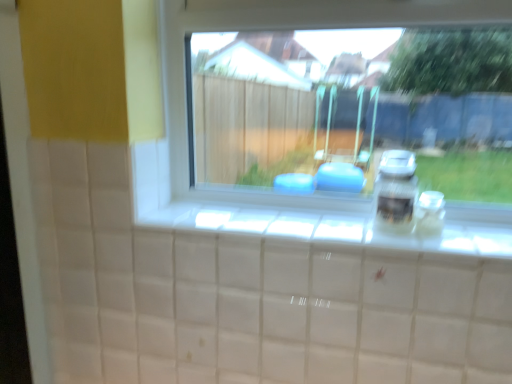
Locate an element on the screen. This screenshot has width=512, height=384. spots to the right of satin silver jar at right is located at coordinates (471, 239).